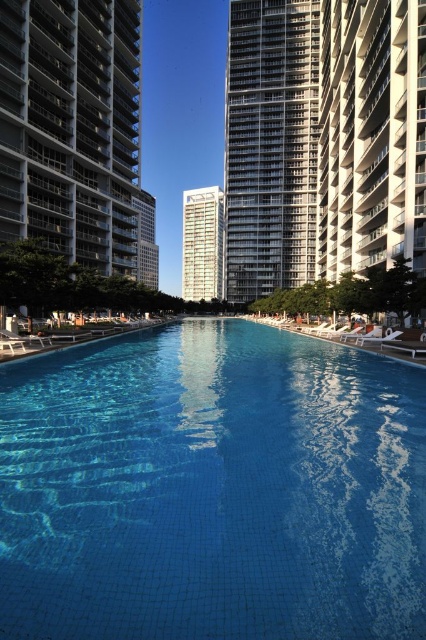
You are standing at the edge of the pool and want to take a photo that includes both the point at coordinates point (178, 524) and point (187, 300). Which point should you focus on to ensure both are in sharp focus?

You should focus on point (187, 300) because it is further away from the camera than point (178, 524). Focusing on the further point will keep both in focus due to the depth of field.